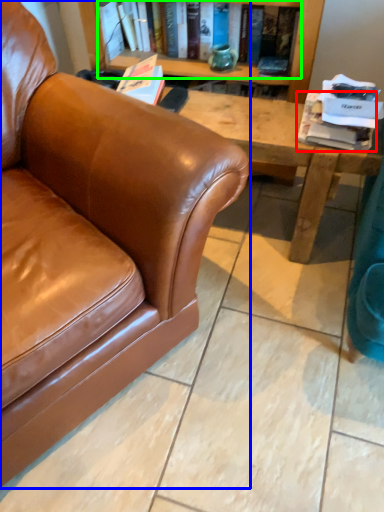
Question: Estimate the real-world distances between objects in this image. Which object is closer to book (highlighted by a red box), studio couch (highlighted by a blue box) or book (highlighted by a green box)?

Choices:
 (A) studio couch
 (B) book

Answer: (B)